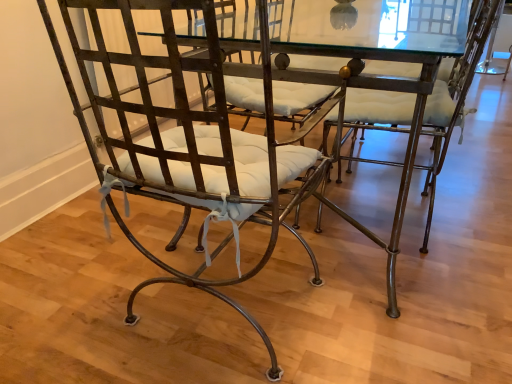
Question: From the image's perspective, is glass transparent table at center above or below matte metal chair at center, which ranks as the second chair in right-to-left order?

Choices:
 (A) below
 (B) above

Answer: (B)

Question: Considering the positions of glass transparent table at center and matte metal chair at center, which appears as the 1th chair when viewed from the left, in the image, is glass transparent table at center bigger or smaller than matte metal chair at center, which appears as the 1th chair when viewed from the left,?

Choices:
 (A) big
 (B) small

Answer: (A)

Question: Which of these objects is positioned closest to the matte metal chair at center, which appears as the 1th chair when viewed from the left?

Choices:
 (A) matte metal chair at center, placed as the first chair when sorted from right to left
 (B) glass transparent table at center

Answer: (B)

Question: Estimate the real-world distances between objects in this image. Which object is farther from the matte metal chair at center, which ranks as the second chair in right-to-left order?

Choices:
 (A) matte metal chair at center, the second chair viewed from the left
 (B) glass transparent table at center

Answer: (A)